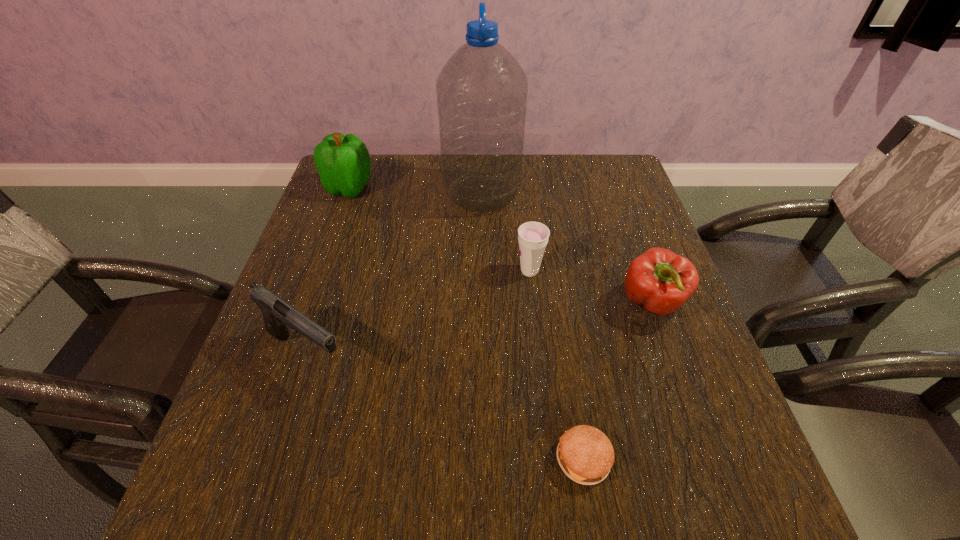
The height and width of the screenshot is (540, 960). I want to click on free space that satisfies the following two spatial constraints: 1. on the front side of the water jug; 2. on the left side of the taller bell pepper, so click(348, 194).

Find the location of `vacant area that satisfies the following two spatial constraints: 1. at the muzzle of the shortest object; 2. on the right side of the gun`. vacant area that satisfies the following two spatial constraints: 1. at the muzzle of the shortest object; 2. on the right side of the gun is located at coordinates (272, 459).